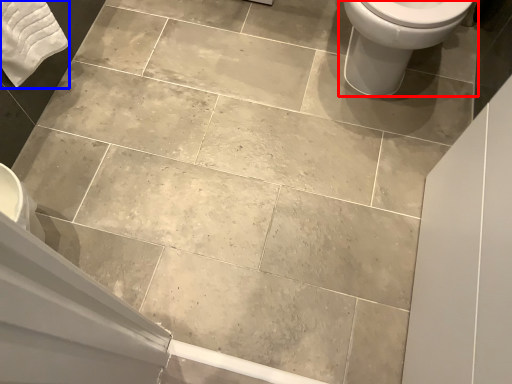
Question: Which object appears closest to the camera in this image, toilet (highlighted by a red box) or bath towel (highlighted by a blue box)?

Choices:
 (A) toilet
 (B) bath towel

Answer: (A)